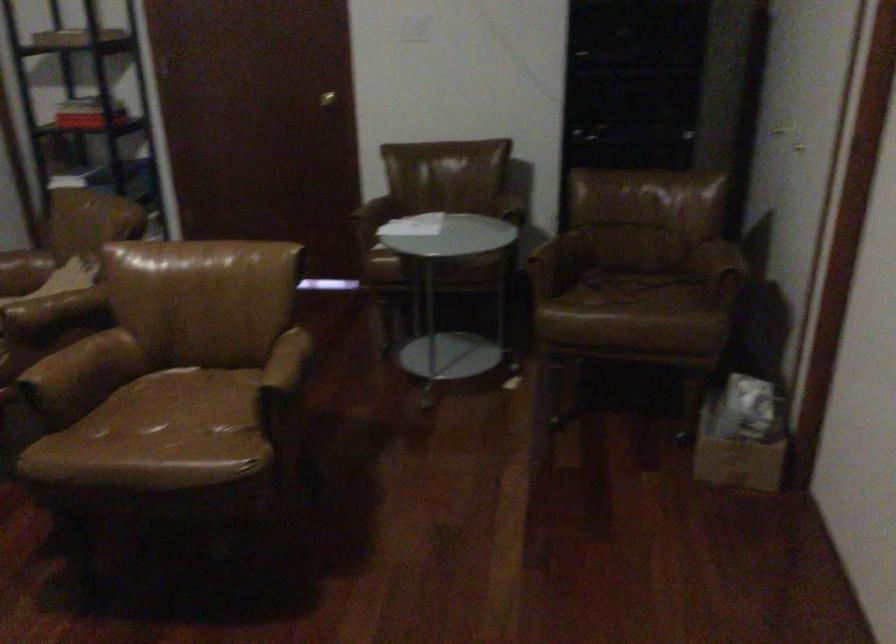
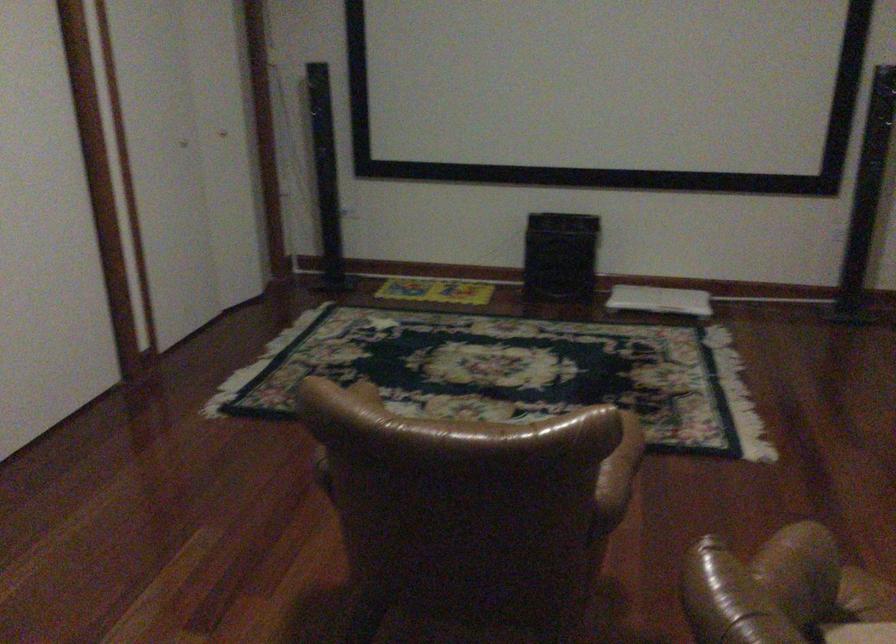
Question: I am providing you with two images of the same scene from different viewpoints. After the viewpoint changes to image2, which objects are now occluded?

Choices:
 (A) brown chair sitting surface
 (B) brown leather armrest
 (C) red chair sitting surface
 (D) black speaker box

Answer: (A)